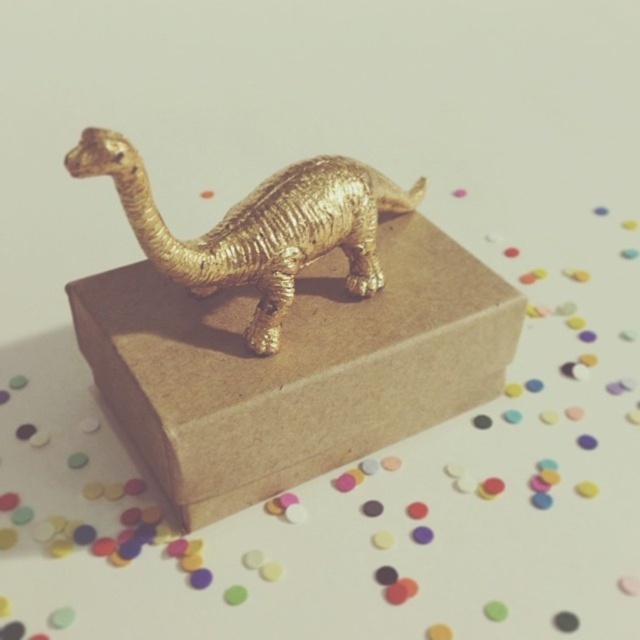
Can you confirm if brown cardboard box at center is shorter than gold textured dinosaur at center?

In fact, brown cardboard box at center may be taller than gold textured dinosaur at center.

You are a GUI agent. You are given a task and a screenshot of the screen. Output one action in this format:
    pyautogui.click(x=<x>, y=<y>)
    Task: Click on the brown cardboard box at center
    This screenshot has height=640, width=640.
    Given the screenshot: What is the action you would take?
    pyautogui.click(x=292, y=365)

Locate an element on the screen. The width and height of the screenshot is (640, 640). brown cardboard box at center is located at coordinates (292, 365).

Locate an element on the screen. brown cardboard box at center is located at coordinates (x=292, y=365).